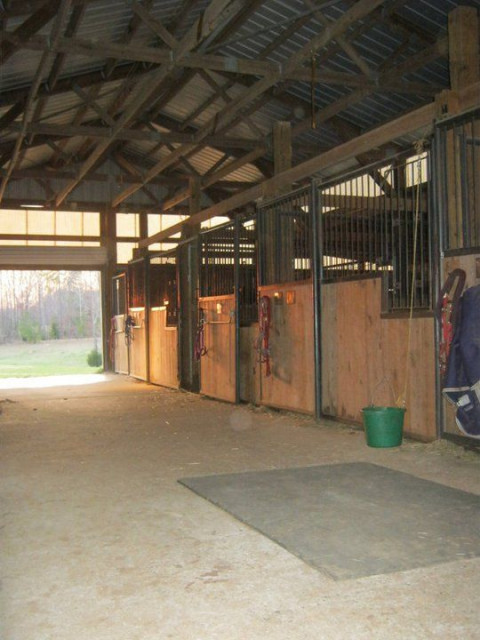
Where is `red notice on door`? red notice on door is located at coordinates (288, 297).